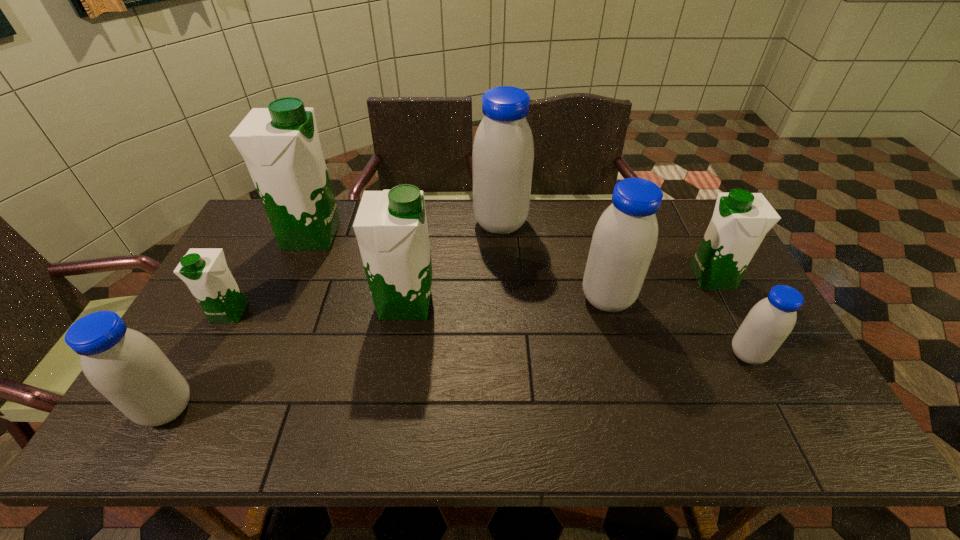
Locate an element on the screen. vacant point that satisfies the following two spatial constraints: 1. on the back side of the second blue soya milk from right to left; 2. on the front-facing side of the farthest green soya milk is located at coordinates (589, 235).